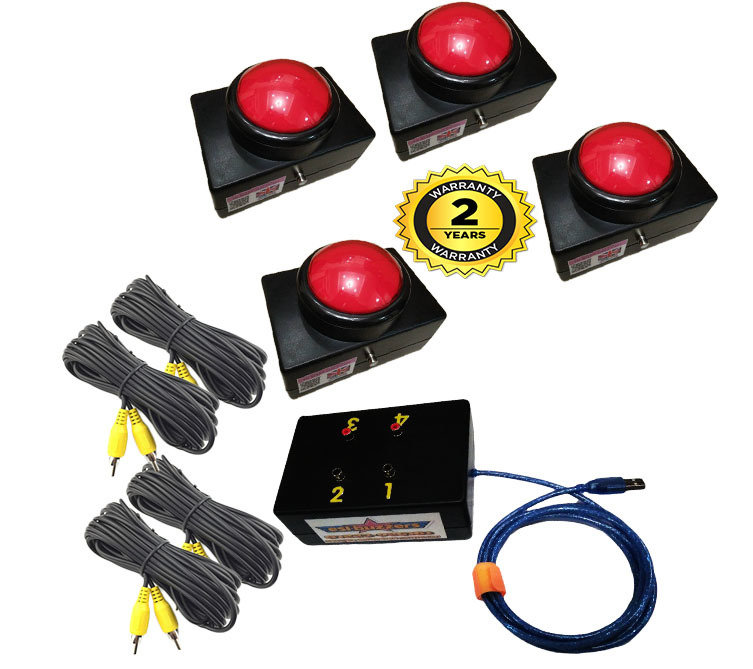
Where is `grey wires`? The image size is (753, 669). grey wires is located at coordinates (177, 566), (221, 520), (178, 413), (223, 356).